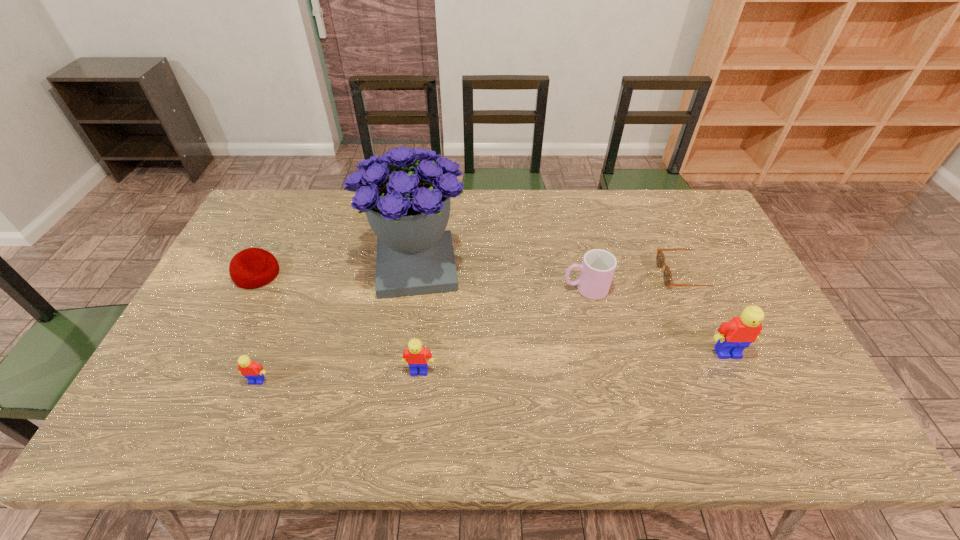
Where is `the third shortest object`? The height and width of the screenshot is (540, 960). the third shortest object is located at coordinates (249, 369).

Where is `the leftmost Lego`? This screenshot has width=960, height=540. the leftmost Lego is located at coordinates (249, 369).

Locate an element on the screen. The height and width of the screenshot is (540, 960). the second Lego from right to left is located at coordinates (416, 355).

Find the location of a particular element. the sixth farthest object is located at coordinates (416, 355).

In order to click on the rightmost Lego in this screenshot , I will do `click(734, 336)`.

What are the coordinates of `the second tallest object` in the screenshot? It's located at (734, 336).

Locate an element on the screen. The image size is (960, 540). the third object from right to left is located at coordinates (598, 266).

At what (x,y) coordinates should I click in order to perform the action: click on beanbag. Please return your answer as a coordinate pair (x, y). The width and height of the screenshot is (960, 540). Looking at the image, I should click on (251, 268).

Where is `the leftmost object`? the leftmost object is located at coordinates (251, 268).

You are a GUI agent. You are given a task and a screenshot of the screen. Output one action in this format:
    pyautogui.click(x=<x>, y=<y>)
    Task: Click on the bouquet
    
    Given the screenshot: What is the action you would take?
    pyautogui.click(x=407, y=205)